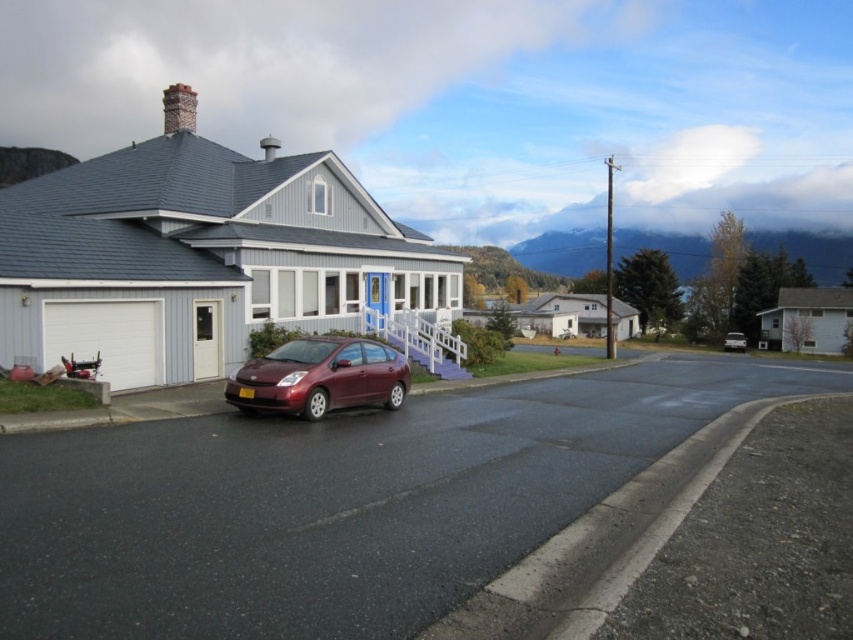
Is satin burgundy car at lower center wider than white matte garage at right?

No.

Between satin burgundy car at lower center and white matte garage at right, which one has more height?

Standing taller between the two is white matte garage at right.

Which is behind, point (323, 356) or point (822, 332)?

Positioned behind is point (822, 332).

At what (x,y) coordinates should I click in order to perform the action: click on satin burgundy car at lower center. Please return your answer as a coordinate pair (x, y). The image size is (853, 640). Looking at the image, I should click on (320, 378).

What do you see at coordinates (807, 321) in the screenshot?
I see `white matte garage at right` at bounding box center [807, 321].

Is white matte garage at right to the left of metallic silver sedan at center from the viewer's perspective?

No, white matte garage at right is not to the left of metallic silver sedan at center.

Who is more forward, (804,300) or (737,348)?

Point (737,348) is more forward.

Where is `white matte garage at right`? This screenshot has height=640, width=853. white matte garage at right is located at coordinates (807, 321).

Can you confirm if white matte garage at left is smaller than metallic silver sedan at center?

No.

Between point (123, 332) and point (738, 342), which one is positioned in front?

Point (123, 332)

Identify the location of white matte garage at left. (200, 256).